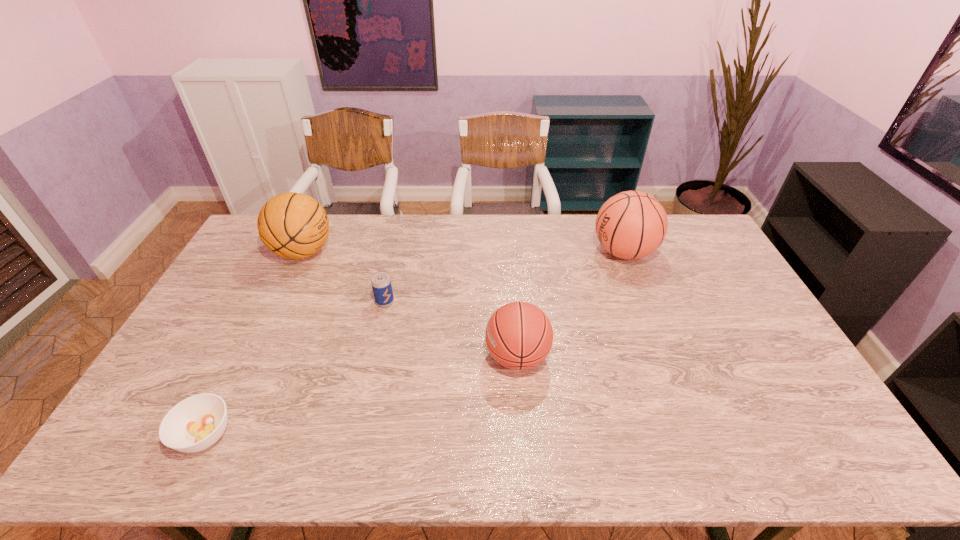
Find the location of `vacant space situated 0.150m on the surface of the rightmost object near the brand logo`. vacant space situated 0.150m on the surface of the rightmost object near the brand logo is located at coordinates (550, 252).

Where is `free spot located 0.260m on the surface of the leftmost basketball near the brand logo`? The image size is (960, 540). free spot located 0.260m on the surface of the leftmost basketball near the brand logo is located at coordinates (406, 252).

You are a GUI agent. You are given a task and a screenshot of the screen. Output one action in this format:
    pyautogui.click(x=<x>, y=<y>)
    Task: Click on the vacant space situated on the logo side of the nearest basketball
    This screenshot has width=960, height=540.
    Given the screenshot: What is the action you would take?
    pyautogui.click(x=433, y=356)

Find the location of a particular element. This screenshot has height=540, width=960. vacant space located on the logo side of the nearest basketball is located at coordinates (397, 356).

Where is `vacant point located 0.330m on the logo side of the nearest basketball`? vacant point located 0.330m on the logo side of the nearest basketball is located at coordinates (370, 356).

The height and width of the screenshot is (540, 960). I want to click on free space located 0.060m on the right of the fourth tallest object, so click(413, 302).

Locate an element on the screen. vacant space positioned on the left of the shortest object is located at coordinates (152, 435).

The width and height of the screenshot is (960, 540). Identify the location of object that is positioned at the near edge. (196, 423).

Where is `basketball at the left edge`? basketball at the left edge is located at coordinates (293, 225).

The width and height of the screenshot is (960, 540). Find the location of `soup bowl located in the left edge section of the desktop`. soup bowl located in the left edge section of the desktop is located at coordinates 196,423.